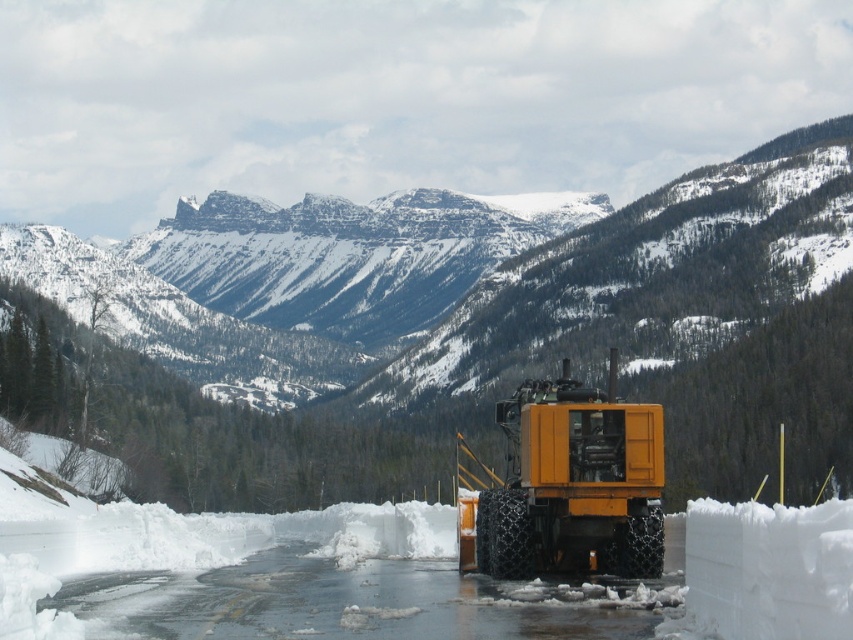
You are a delivery driver trying to navigate through the snowy road. You see the snowy rock mountain at center and the yellow matte forklift at center. Which object is positioned to the left side from your perspective?

The snowy rock mountain at center is to the left of the yellow matte forklift at center, so the snowy rock mountain at center is positioned to the left side from your perspective.

You are a photographer planning to capture the snowy rock mountain at center and the yellow matte forklift at center in a single frame. Based on their sizes, which object will appear closer to the camera in the photo?

The snowy rock mountain at center is larger in size than the yellow matte forklift at center, so the snowy rock mountain at center will appear closer to the camera in the photo because larger objects in a frame typically indicate they are nearer to the viewer.

You are a photographer planning to capture the snowy rock mountain at center and the yellow matte forklift at center in a single wide shot. Based on their sizes, do you think both can fit within the camera frame without cropping either object?

The snowy rock mountain at center might be wider than yellow matte forklift at center, so it is possible that the snowy rock mountain at center may occupy more of the frame, but both could still fit if the camera is positioned to include both objects within the shot.